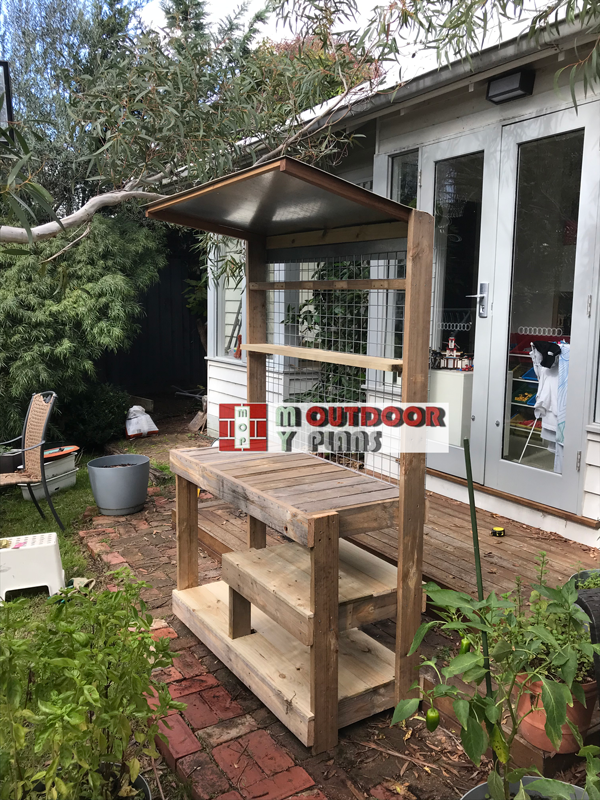
Locate an element on the screen. The image size is (600, 800). door is located at coordinates (531, 409).